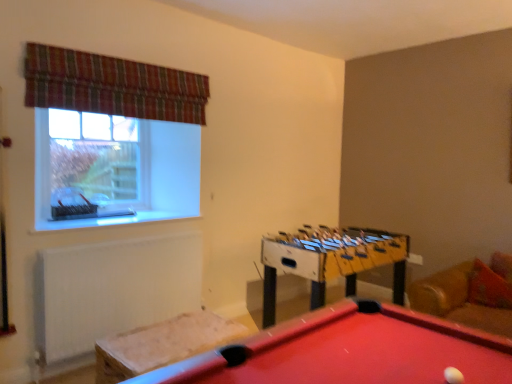
Question: Would you say clear glass window at upper left is part of velvet-like beige cushion at lower left's contents?

Choices:
 (A) yes
 (B) no

Answer: (B)

Question: Is velvet-like beige cushion at lower left smaller than clear glass window at upper left?

Choices:
 (A) no
 (B) yes

Answer: (A)

Question: From the image's perspective, does velvet-like beige cushion at lower left appear lower than clear glass window at upper left?

Choices:
 (A) no
 (B) yes

Answer: (B)

Question: Can you confirm if velvet-like beige cushion at lower left is positioned to the left of clear glass window at upper left?

Choices:
 (A) yes
 (B) no

Answer: (B)

Question: Considering the relative sizes of velvet-like beige cushion at lower left and clear glass window at upper left in the image provided, is velvet-like beige cushion at lower left bigger than clear glass window at upper left?

Choices:
 (A) yes
 (B) no

Answer: (A)

Question: From the image's perspective, is velvet-like beige cushion at lower left above clear glass window at upper left?

Choices:
 (A) no
 (B) yes

Answer: (A)

Question: Does clear glass window at upper left have a greater width compared to white matte radiator at lower left?

Choices:
 (A) no
 (B) yes

Answer: (A)

Question: From the image's perspective, is clear glass window at upper left on top of white matte radiator at lower left?

Choices:
 (A) yes
 (B) no

Answer: (A)

Question: Could you tell me if clear glass window at upper left is facing white matte radiator at lower left?

Choices:
 (A) no
 (B) yes

Answer: (A)

Question: Does clear glass window at upper left appear on the right side of white matte radiator at lower left?

Choices:
 (A) yes
 (B) no

Answer: (B)

Question: Does clear glass window at upper left have a lesser height compared to white matte radiator at lower left?

Choices:
 (A) no
 (B) yes

Answer: (B)

Question: Are clear glass window at upper left and white matte radiator at lower left far apart?

Choices:
 (A) yes
 (B) no

Answer: (B)

Question: Is yellow plastic foosball table at center facing away from clear glass window at upper left?

Choices:
 (A) no
 (B) yes

Answer: (A)